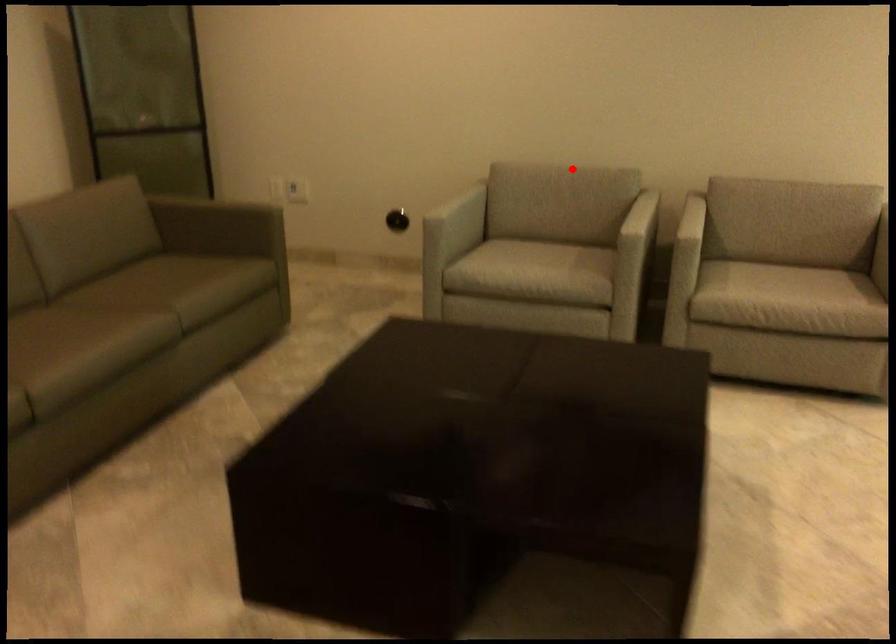
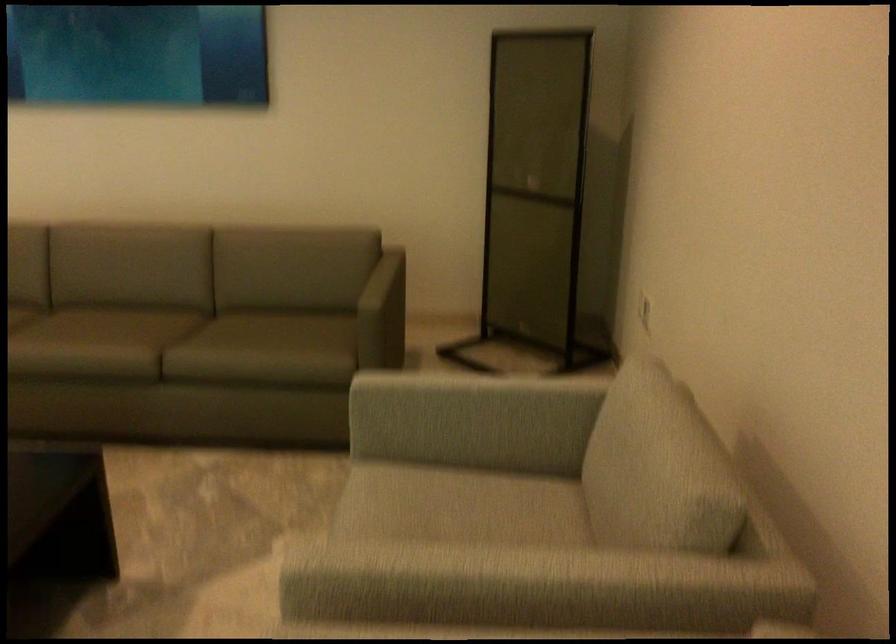
Where in the second image is the point corresponding to the highlighted location from the first image?

(653, 451)